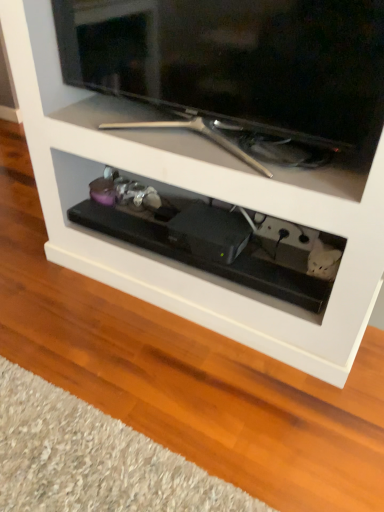
Question: Is matte black television at upper center outside of black plastic drawer at center?

Choices:
 (A) yes
 (B) no

Answer: (A)

Question: Is matte black television at upper center further to camera compared to black plastic drawer at center?

Choices:
 (A) yes
 (B) no

Answer: (B)

Question: Considering the relative sizes of matte black television at upper center and black plastic drawer at center in the image provided, is matte black television at upper center bigger than black plastic drawer at center?

Choices:
 (A) no
 (B) yes

Answer: (B)

Question: From the image's perspective, is matte black television at upper center located above black plastic drawer at center?

Choices:
 (A) yes
 (B) no

Answer: (A)

Question: Considering the relative sizes of matte black television at upper center and black plastic drawer at center in the image provided, is matte black television at upper center shorter than black plastic drawer at center?

Choices:
 (A) no
 (B) yes

Answer: (A)

Question: Considering the relative positions of matte black television at upper center and black plastic drawer at center in the image provided, is matte black television at upper center to the left of black plastic drawer at center from the viewer's perspective?

Choices:
 (A) yes
 (B) no

Answer: (B)

Question: From the image's perspective, is black plastic drawer at center located above matte black television at upper center?

Choices:
 (A) yes
 (B) no

Answer: (B)

Question: Are black plastic drawer at center and matte black television at upper center far apart?

Choices:
 (A) no
 (B) yes

Answer: (A)

Question: Can you confirm if black plastic drawer at center is bigger than matte black television at upper center?

Choices:
 (A) no
 (B) yes

Answer: (A)

Question: Is black plastic drawer at center facing towards matte black television at upper center?

Choices:
 (A) no
 (B) yes

Answer: (A)

Question: Does black plastic drawer at center come behind matte black television at upper center?

Choices:
 (A) no
 (B) yes

Answer: (B)

Question: Does black plastic drawer at center have a greater height compared to matte black television at upper center?

Choices:
 (A) yes
 (B) no

Answer: (B)

Question: From the image's perspective, is matte black television at upper center positioned above or below black plastic drawer at center?

Choices:
 (A) above
 (B) below

Answer: (A)